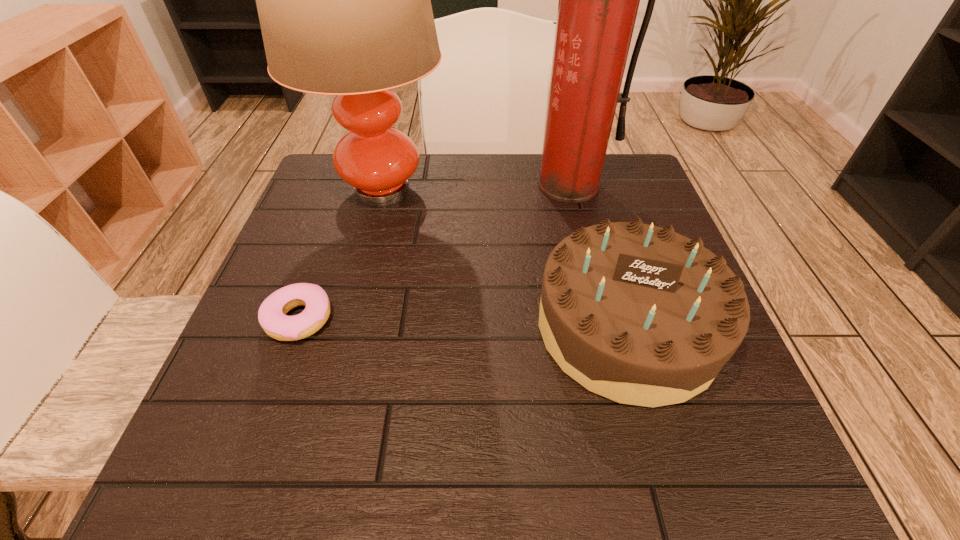
Identify which object is located as the nearest to the lamp. Please provide its 2D coordinates. Your answer should be formatted as a tuple, i.e. [(x, y)], where the tuple contains the x and y coordinates of a point satisfying the conditions above.

[(272, 317)]

Identify which object is the second nearest to the fire extinguisher. Please provide its 2D coordinates. Your answer should be formatted as a tuple, i.e. [(x, y)], where the tuple contains the x and y coordinates of a point satisfying the conditions above.

[(639, 314)]

This screenshot has width=960, height=540. Find the location of `vacant area in the image that satisfies the following two spatial constraints: 1. on the back side of the shortest object; 2. on the right side of the lamp`. vacant area in the image that satisfies the following two spatial constraints: 1. on the back side of the shortest object; 2. on the right side of the lamp is located at coordinates (346, 191).